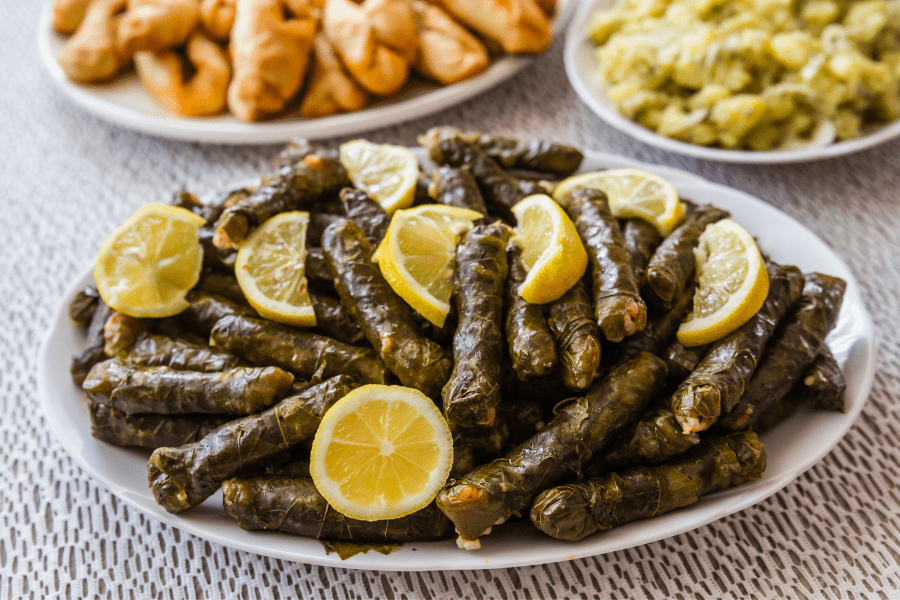
At what (x,y) coordinates should I click in order to perform the action: click on tabletop. Please return your answer as a coordinate pair (x, y). The height and width of the screenshot is (600, 900). Looking at the image, I should click on (841, 508).